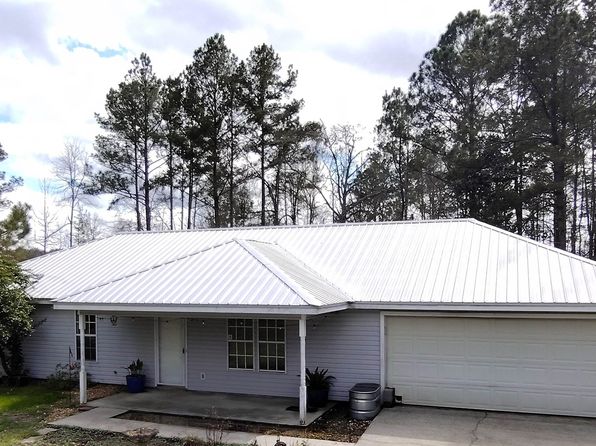
This screenshot has width=596, height=446. Find the location of `planters`. planters is located at coordinates (129, 381).